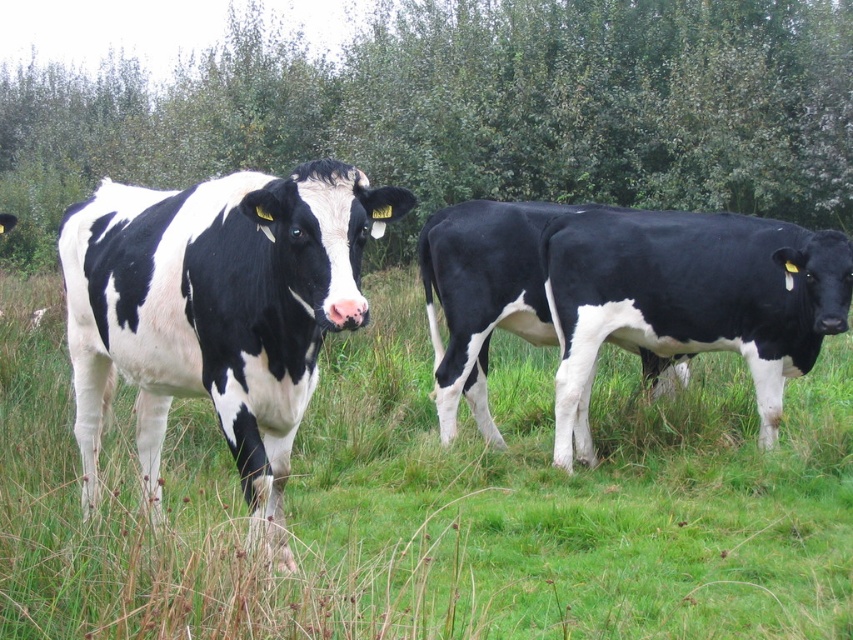
You are a farmer checking the cows in your field. You notice the black and white cow at left and the black smooth cow at center. Which cow is blocking the view of the other?

The black and white cow at left is positioned under the black smooth cow at center, so the black smooth cow at center is blocking the view of the black and white cow at left.

You are standing in a grassy field with two cows. You notice two points marked on the ground at coordinates point (230,198) and point (485,220). Which point is closer to you from your current position?

Point (230,198) is in front of point (485,220), so it is closer to you.

You are a farmer who wants to locate the black and white cow at center in the field. According to the coordinate system where the bottom left corner is the origin, can you confirm the cow is positioned at the center of the field?

The black and white cow at center is located at coordinates point (436, 500), which is not exactly the center of the field. The center would be at coordinates (426, 320), so the cow is positioned to the right and above the center point.